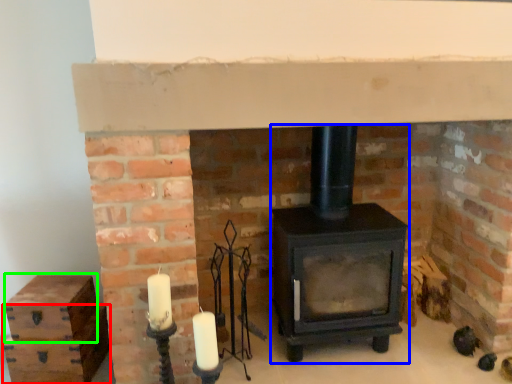
Question: Which is nearer to the drawer (highlighted by a red box)? wood burning stove (highlighted by a blue box) or drawer (highlighted by a green box).

Choices:
 (A) wood burning stove
 (B) drawer

Answer: (B)